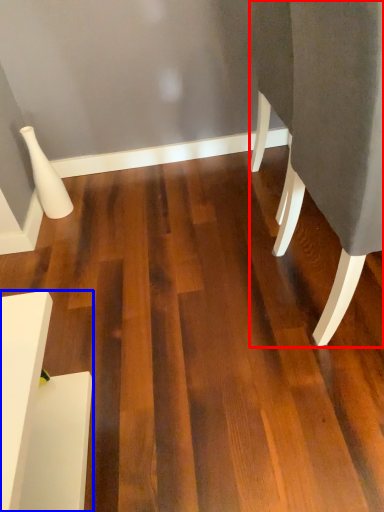
Question: Which point is closer to the camera, furniture (highlighted by a red box) or furniture (highlighted by a blue box)?

Choices:
 (A) furniture
 (B) furniture

Answer: (A)